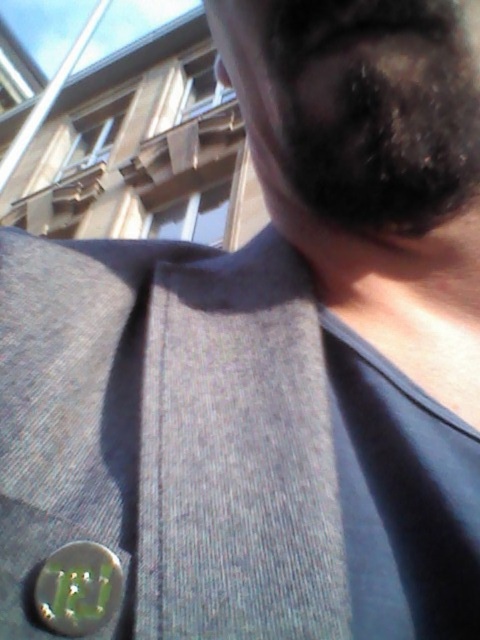
Question: Among these points, which one is farthest from the camera?

Choices:
 (A) (4, 580)
 (B) (455, 76)

Answer: (B)

Question: Does black fuzzy beard at upper right have a lesser width compared to green metallic button at lower left?

Choices:
 (A) no
 (B) yes

Answer: (A)

Question: Is black fuzzy beard at upper right to the left of green metallic button at lower left from the viewer's perspective?

Choices:
 (A) yes
 (B) no

Answer: (B)

Question: Which object appears closest to the camera in this image?

Choices:
 (A) black fuzzy beard at upper right
 (B) green metallic button at lower left

Answer: (B)

Question: Does black fuzzy beard at upper right appear on the left side of green metallic button at lower left?

Choices:
 (A) yes
 (B) no

Answer: (B)